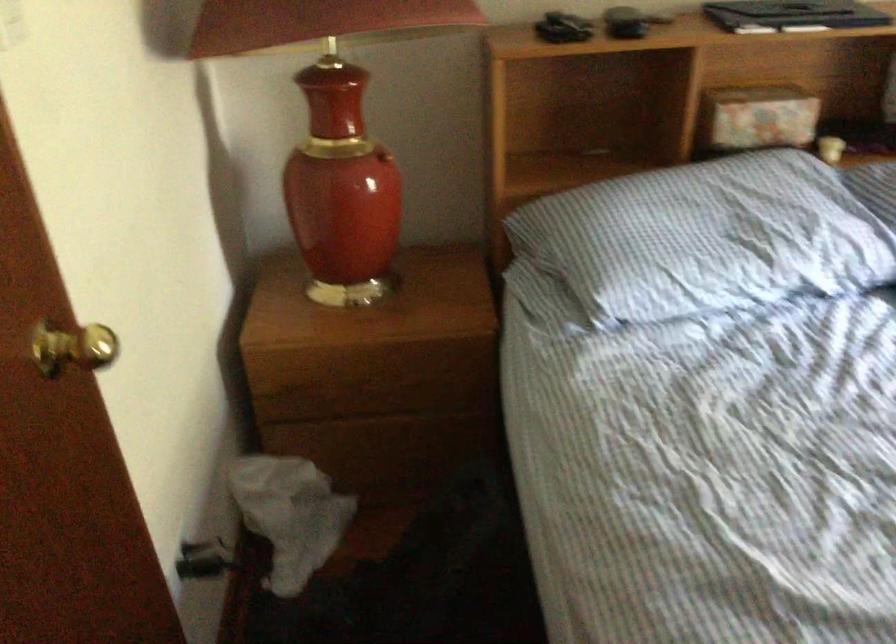
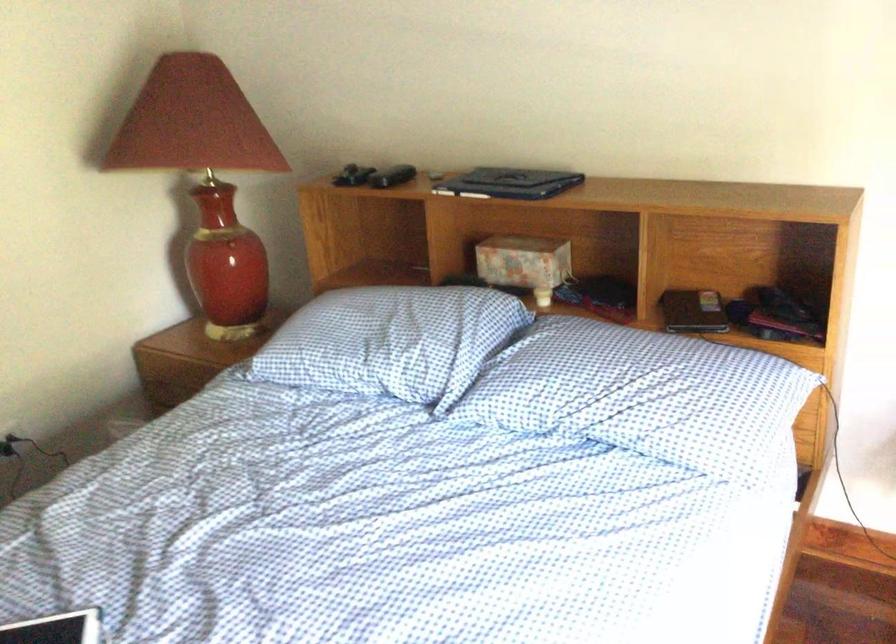
Find the pixel in the second image that matches point (796, 111) in the first image.

(524, 263)